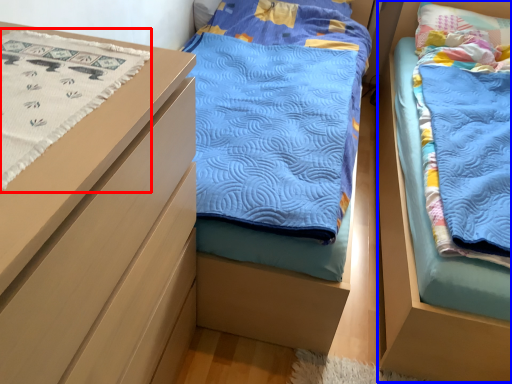
Question: Which of the following is the closest to the observer, blanket (highlighted by a red box) or bed (highlighted by a blue box)?

Choices:
 (A) blanket
 (B) bed

Answer: (A)